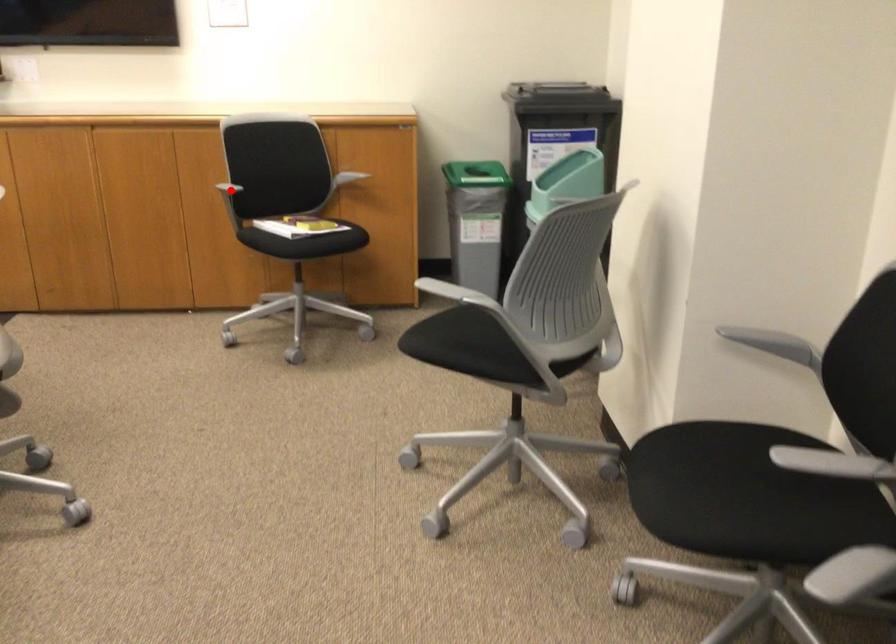
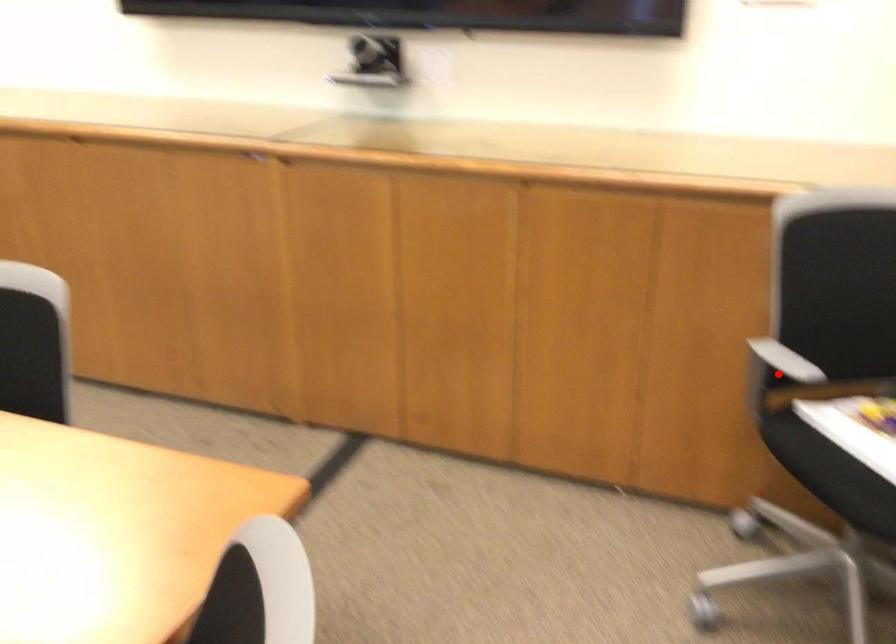
I am providing you with two images of the same scene from different viewpoints. A red point is marked on the first image and another point is marked on the second image. Does the point marked in image1 correspond to the same location as the one in image2?

Yes